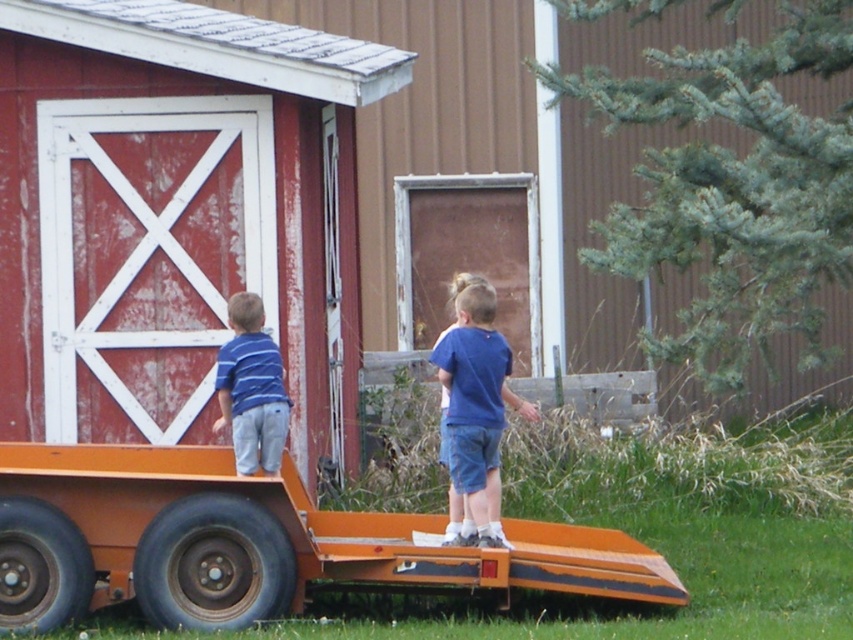
You are a delivery driver who needs to back up your truck to load packages. You see the orange matte trailer truck at lower left and the red painted wood barn door at left. Which object is closer to you as you look forward from the driver seat?

The orange matte trailer truck at lower left is closer to you because it is in front of the red painted wood barn door at left.

You are a photographer trying to capture both children in a single shot. Since the blue cotton shirt at center is larger than the blue striped shirt at left, which child should you focus on to ensure both are clearly visible in the photo?

Focus on the blue cotton shirt at center because it is larger and will be more visible, ensuring the blue striped shirt at left is also captured in the frame.

You are standing at the point marked as point [251,541]. What object are you currently standing on?

You are standing on the orange matte trailer truck at lower left.